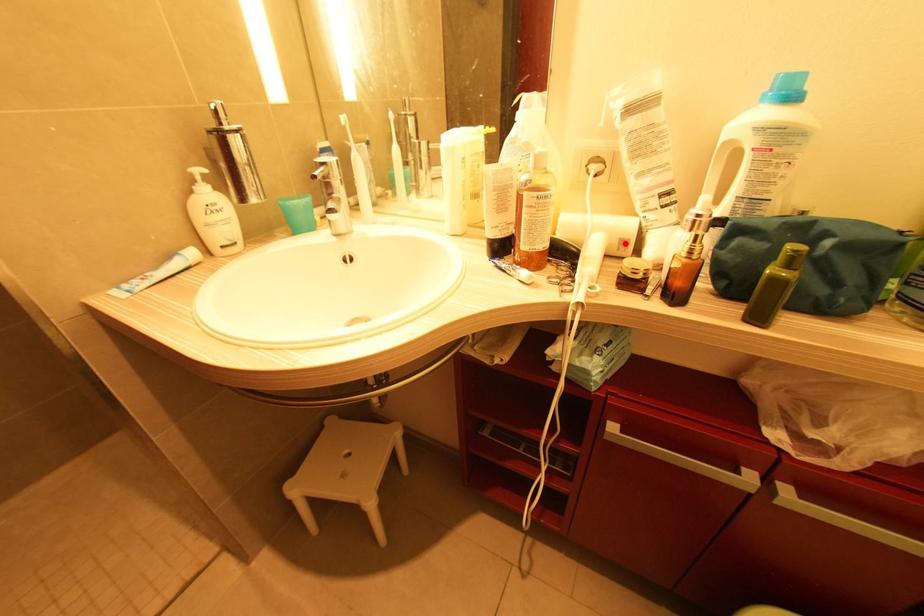
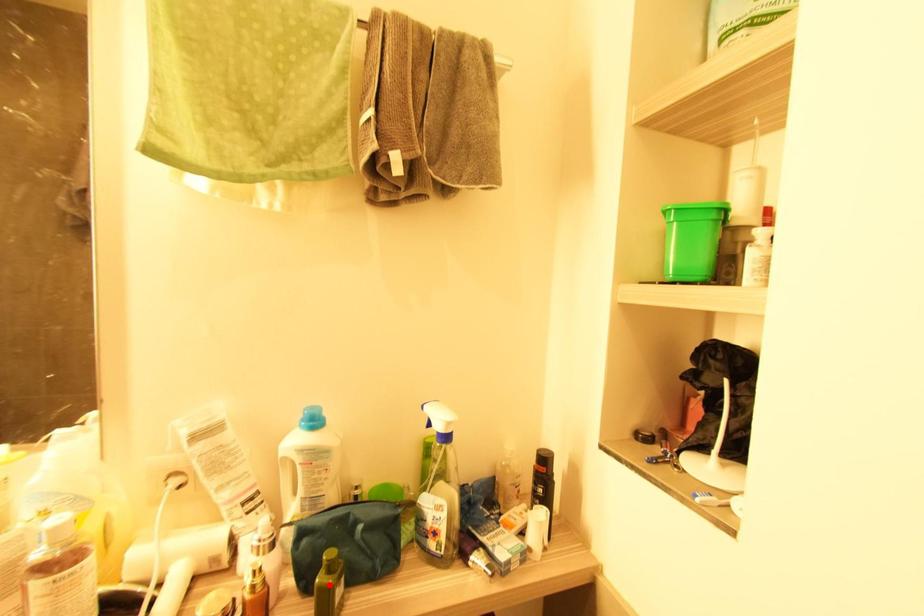
I am providing you with two images of the same scene from different viewpoints. A red point is marked on the first image and another point is marked on the second image. Does the point marked in image1 correspond to the same location as the one in image2?

No